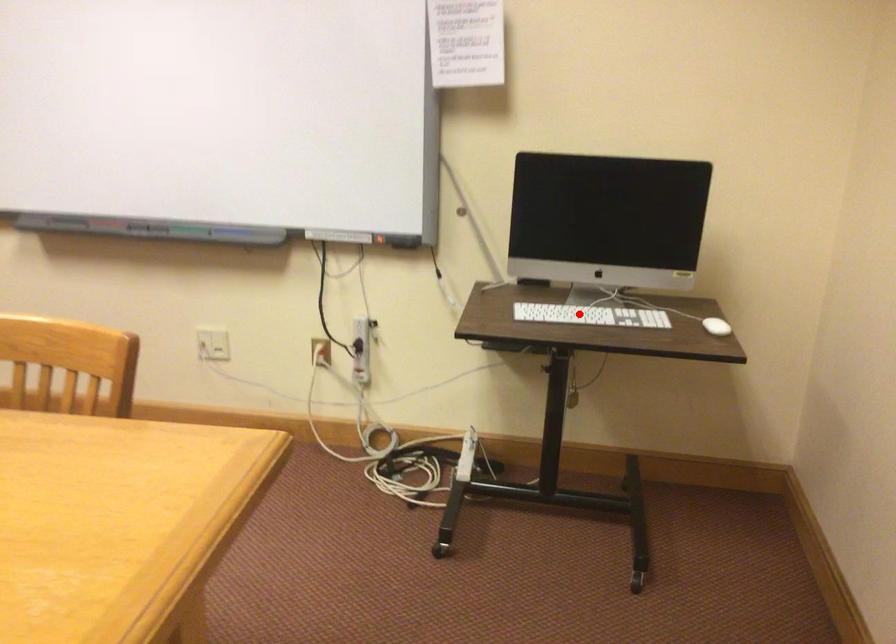
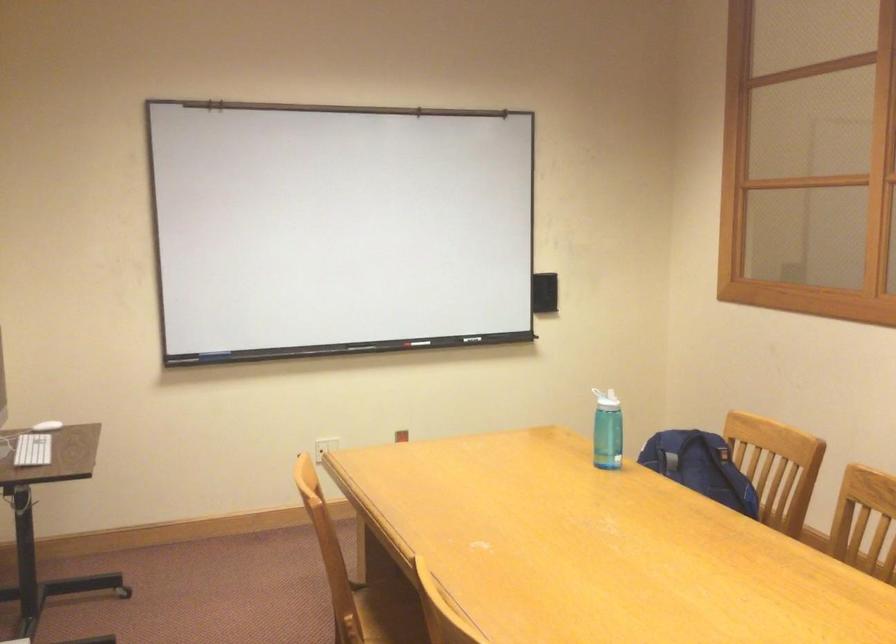
In the second image, find the point that corresponds to the highlighted location in the first image.

(32, 450)